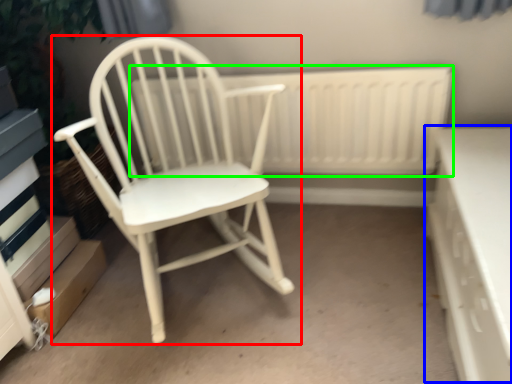
Question: Considering the real-world distances, which object is closest to chair (highlighted by a red box)? table (highlighted by a blue box) or radiator (highlighted by a green box).

Choices:
 (A) table
 (B) radiator

Answer: (B)